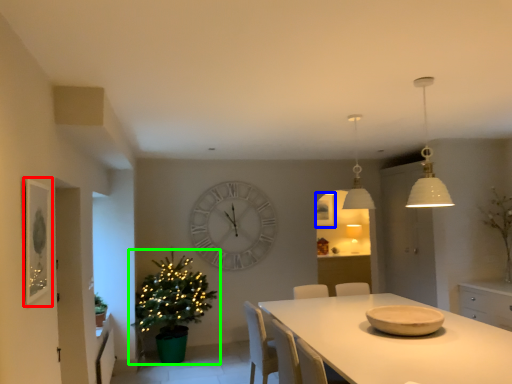
Question: Estimate the real-world distances between objects in this image. Which object is closer to picture frame (highlighted by a red box), picture frame (highlighted by a blue box) or christmas tree (highlighted by a green box)?

Choices:
 (A) picture frame
 (B) christmas tree

Answer: (B)